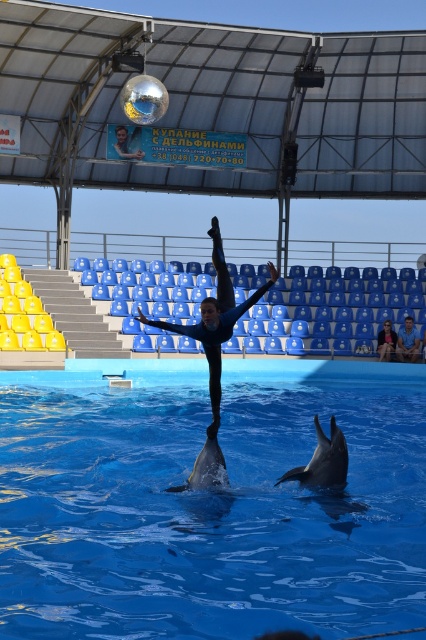
Which is above, blue matte gymnast at center or blue fabric pants at lower right?

blue fabric pants at lower right is above.

Does blue matte gymnast at center appear on the right side of blue fabric pants at lower right?

Incorrect, blue matte gymnast at center is not on the right side of blue fabric pants at lower right.

Is point (209, 316) positioned in front of point (383, 349)?

Yes, it is in front of point (383, 349).

The width and height of the screenshot is (426, 640). I want to click on blue matte gymnast at center, so click(x=215, y=321).

Looking at this image, which is more to the right, smooth gray dolphin at center or light brown leather jacket at lower right?

light brown leather jacket at lower right

Between smooth gray dolphin at center and light brown leather jacket at lower right, which one is positioned lower?

smooth gray dolphin at center is lower down.

Is point (207, 436) positioned behind point (416, 330)?

No, it is not.

Find the location of a particular element. This screenshot has width=426, height=640. smooth gray dolphin at center is located at coordinates (206, 468).

Is blue matte gymnast at center bigger than smooth gray dolphin at lower center?

Incorrect, blue matte gymnast at center is not larger than smooth gray dolphin at lower center.

Between blue matte gymnast at center and smooth gray dolphin at lower center, which one has less height?

blue matte gymnast at center is shorter.

The width and height of the screenshot is (426, 640). I want to click on blue matte gymnast at center, so click(x=215, y=321).